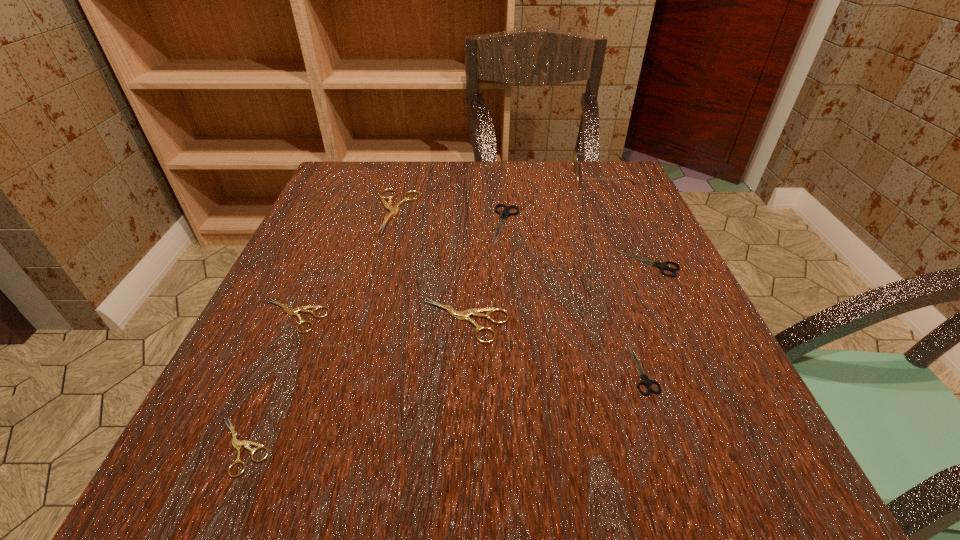
You are a GUI agent. You are given a task and a screenshot of the screen. Output one action in this format:
    pyautogui.click(x=<x>, y=<y>)
    Task: Click on the vacant space situated 0.390m on the back of the second biggest beige shears
    The width and height of the screenshot is (960, 540).
    Given the screenshot: What is the action you would take?
    pyautogui.click(x=469, y=187)

Find the location of a particular element. The height and width of the screenshot is (540, 960). vacant space located on the back of the third biggest beige shears is located at coordinates (320, 256).

You are a GUI agent. You are given a task and a screenshot of the screen. Output one action in this format:
    pyautogui.click(x=<x>, y=<y>)
    Task: Click on the vacant space located 0.150m on the left of the second nearest shears
    Image resolution: width=960 pixels, height=540 pixels.
    Given the screenshot: What is the action you would take?
    pyautogui.click(x=531, y=369)

You are a GUI agent. You are given a task and a screenshot of the screen. Output one action in this format:
    pyautogui.click(x=<x>, y=<y>)
    Task: Click on the blank area located on the right of the nearest shears
    This screenshot has width=960, height=540.
    Given the screenshot: What is the action you would take?
    pyautogui.click(x=537, y=447)

I want to click on sunglasses at the far edge, so click(x=575, y=160).

This screenshot has width=960, height=540. What are the coordinates of `object at the near edge` in the screenshot? It's located at (237, 444).

Locate an element on the screen. Image resolution: width=960 pixels, height=540 pixels. sunglasses at the right edge is located at coordinates (575, 160).

The width and height of the screenshot is (960, 540). I want to click on object positioned at the far left corner, so click(393, 210).

This screenshot has width=960, height=540. In order to click on object at the near left corner in this screenshot , I will do `click(237, 444)`.

The height and width of the screenshot is (540, 960). What are the coordinates of `object that is at the far right corner` in the screenshot? It's located at (575, 160).